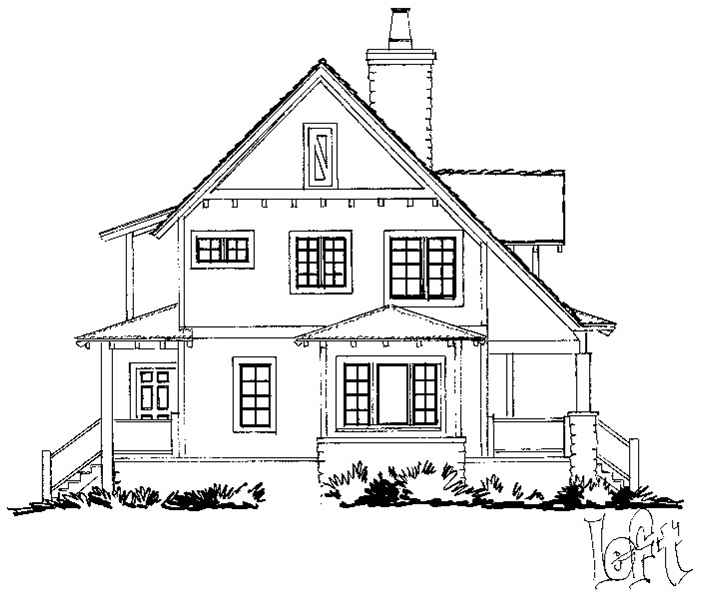
Where is `window`? The width and height of the screenshot is (725, 600). window is located at coordinates (262, 386).